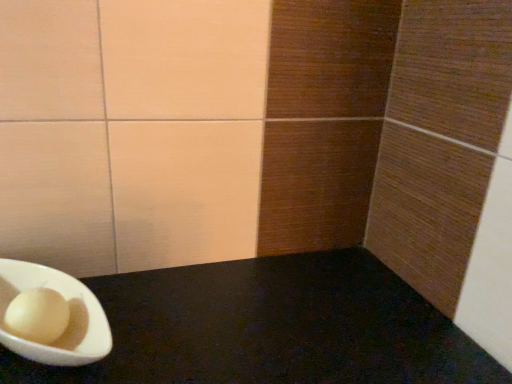
In order to face white matte bowl at lower left, should I rotate leftwards or rightwards?

A 23.052 degree turn to the left will do.

Describe the element at coordinates (69, 321) in the screenshot. The image size is (512, 384). I see `white matte bowl at lower left` at that location.

Where is `white matte bowl at lower left`? The width and height of the screenshot is (512, 384). white matte bowl at lower left is located at coordinates (69, 321).

What are the coordinates of `white matte bowl at lower left` in the screenshot? It's located at (69, 321).